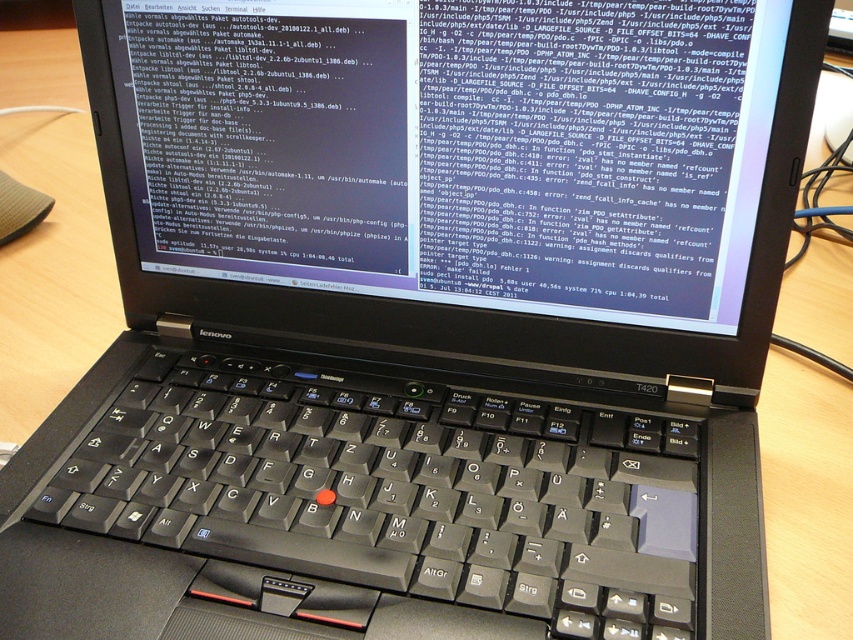
Question: Which point is farther to the camera?

Choices:
 (A) (576, 512)
 (B) (259, 189)

Answer: (B)

Question: Which object appears closest to the camera in this image?

Choices:
 (A) black matte keyboard at center
 (B) black glossy screen at upper center

Answer: (A)

Question: Can you confirm if black glossy screen at upper center is bigger than black matte keyboard at center?

Choices:
 (A) yes
 (B) no

Answer: (A)

Question: Is black glossy screen at upper center above black matte keyboard at center?

Choices:
 (A) no
 (B) yes

Answer: (B)

Question: Is black glossy screen at upper center wider than black matte keyboard at center?

Choices:
 (A) no
 (B) yes

Answer: (A)